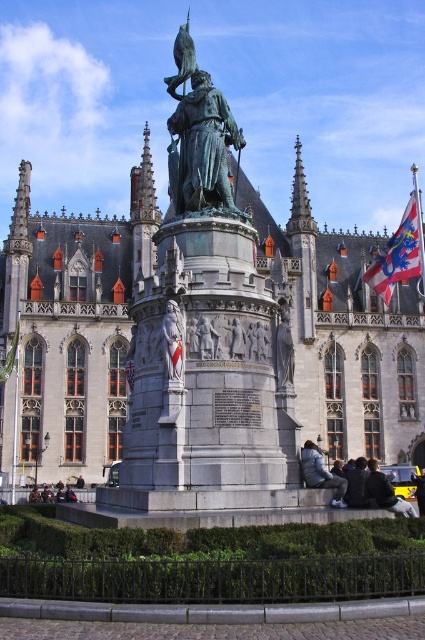
Who is lower down, dark gray jacket at lower center or gray stone relief at center?

dark gray jacket at lower center is lower down.

Is point (356, 470) farther from camera compared to point (206, 333)?

Yes, it is.

What are the coordinates of `dark gray jacket at lower center` in the screenshot? It's located at (357, 484).

Between stone gray building at center and white fabric flag at center, which one is positioned higher?

stone gray building at center is above.

The image size is (425, 640). What do you see at coordinates (70, 330) in the screenshot? I see `stone gray building at center` at bounding box center [70, 330].

Is point (82, 412) positioned after point (175, 369)?

That is True.

Locate an element on the screen. The height and width of the screenshot is (640, 425). stone gray building at center is located at coordinates (70, 330).

Does point (421, 236) come farther from viewer compared to point (365, 476)?

That is True.

Can you confirm if silky blue flag at upper right is positioned to the right of dark gray jacket at lower center?

Correct, you'll find silky blue flag at upper right to the right of dark gray jacket at lower center.

Who is more forward, (404, 252) or (359, 497)?

Point (359, 497) is more forward.

Find the location of a particular element. silky blue flag at upper right is located at coordinates (399, 253).